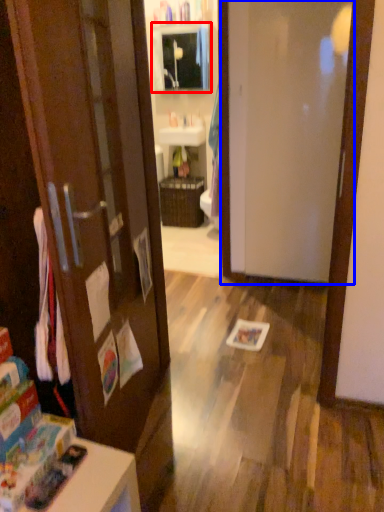
Question: Which of the following is the closest to the observer, medicine cabinet (highlighted by a red box) or door (highlighted by a blue box)?

Choices:
 (A) medicine cabinet
 (B) door

Answer: (B)